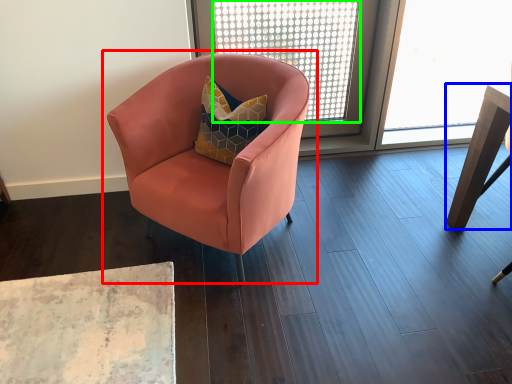
Question: Which is farther away from chair (highlighted by a red box)? table (highlighted by a blue box) or window screen (highlighted by a green box)?

Choices:
 (A) table
 (B) window screen

Answer: (B)